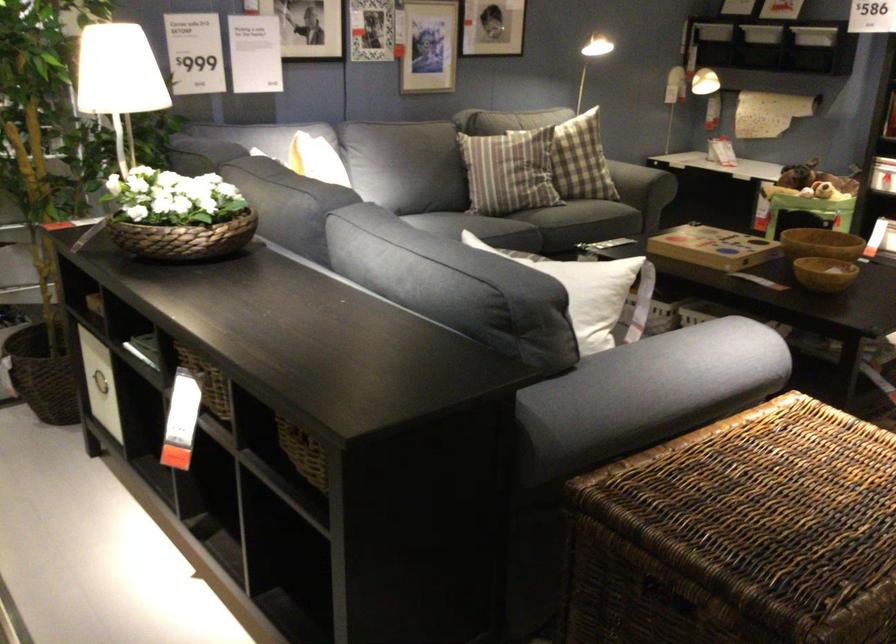
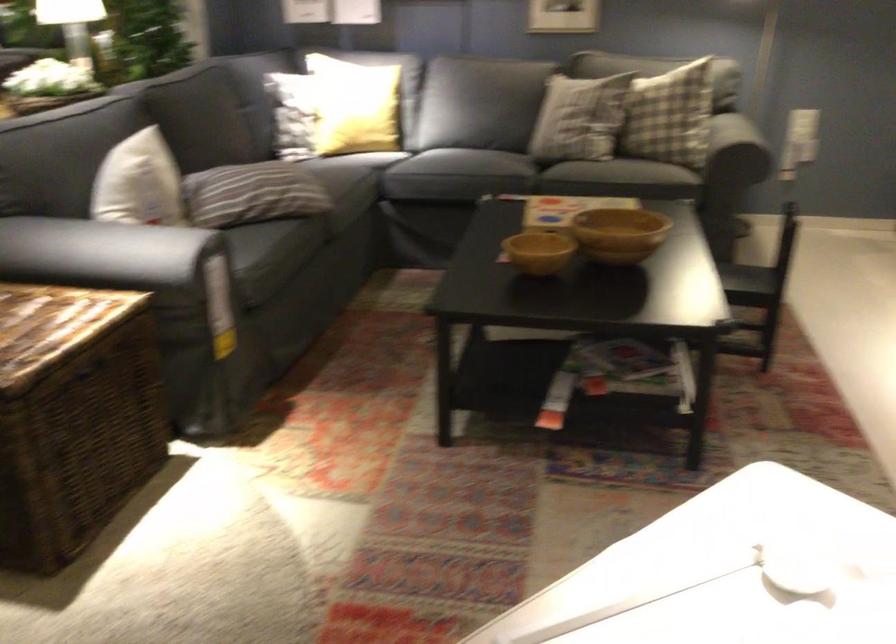
Where in the second image is the point corresponding to pixel 771 426 from the first image?

(55, 317)